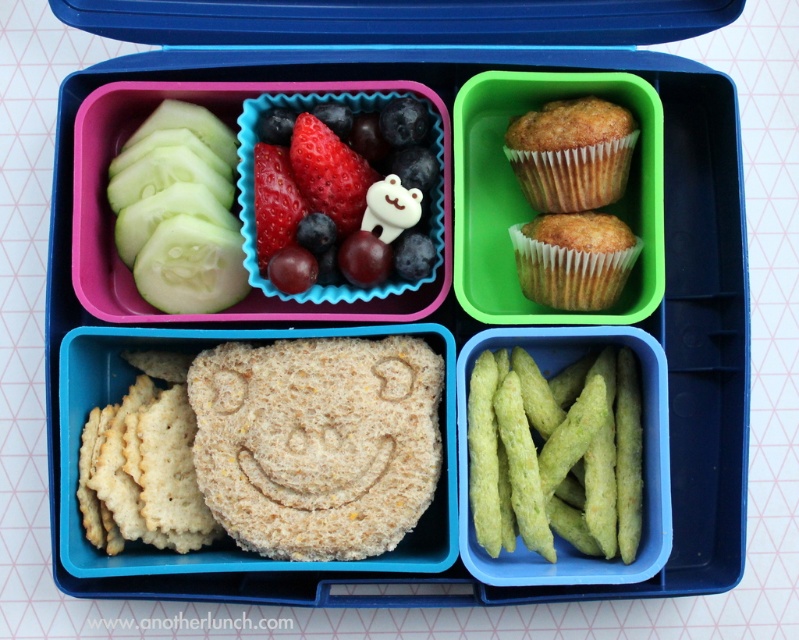
Question: Can you confirm if green textured vegetable at bottom right is thinner than golden-brown muffin at upper right?

Choices:
 (A) no
 (B) yes

Answer: (A)

Question: Does matte plastic container at upper right have a greater width compared to green textured vegetable at bottom right?

Choices:
 (A) yes
 (B) no

Answer: (A)

Question: Among these points, which one is nearest to the camera?

Choices:
 (A) (227, 483)
 (B) (392, 196)
 (C) (575, 182)

Answer: (A)

Question: Which object is the farthest from the brown crumbly sandwich at center?

Choices:
 (A) smooth white bear at center
 (B) golden brown muffin at upper right

Answer: (B)

Question: Considering the real-world distances, which object is farthest from the golden brown muffin at upper right?

Choices:
 (A) golden-brown muffin at upper right
 (B) green textured vegetable at bottom right
 (C) matte plastic container at upper right
 (D) brown crumbly sandwich at center

Answer: (D)

Question: Is brown crumbly sandwich at center to the right of golden brown muffin at upper right from the viewer's perspective?

Choices:
 (A) no
 (B) yes

Answer: (A)